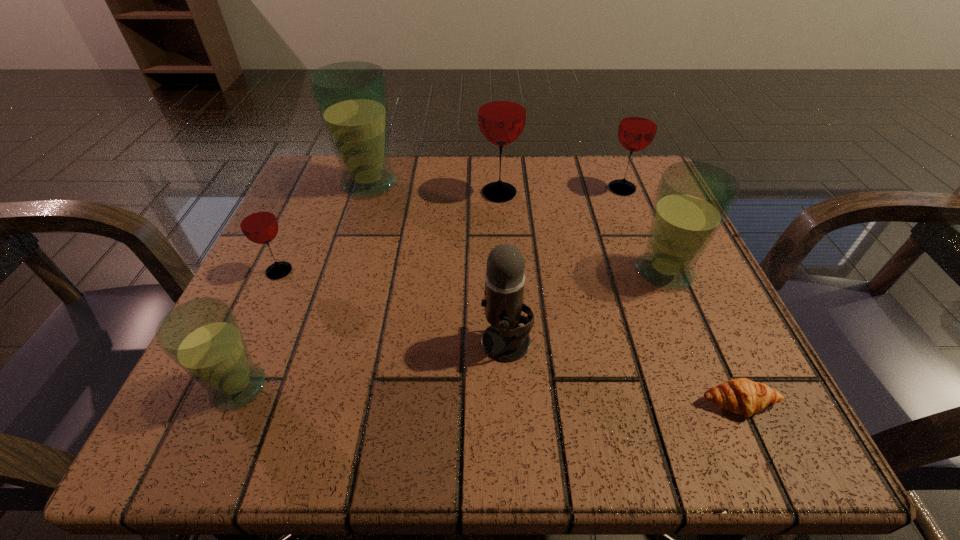
The width and height of the screenshot is (960, 540). In order to click on free space that satisfies the following two spatial constraints: 1. on the back side of the fourth glass from left to right; 2. on the right side of the microphone in this screenshot , I will do `click(498, 193)`.

This screenshot has width=960, height=540. In order to click on free point that satisfies the following two spatial constraints: 1. on the front side of the smallest red glass; 2. on the right side of the smallest blue glass in this screenshot , I will do `click(226, 387)`.

The width and height of the screenshot is (960, 540). What are the coordinates of `vacant space that satisfies the following two spatial constraints: 1. on the front side of the biggest blue glass; 2. on the right side of the fourth glass from left to right` in the screenshot? It's located at (366, 193).